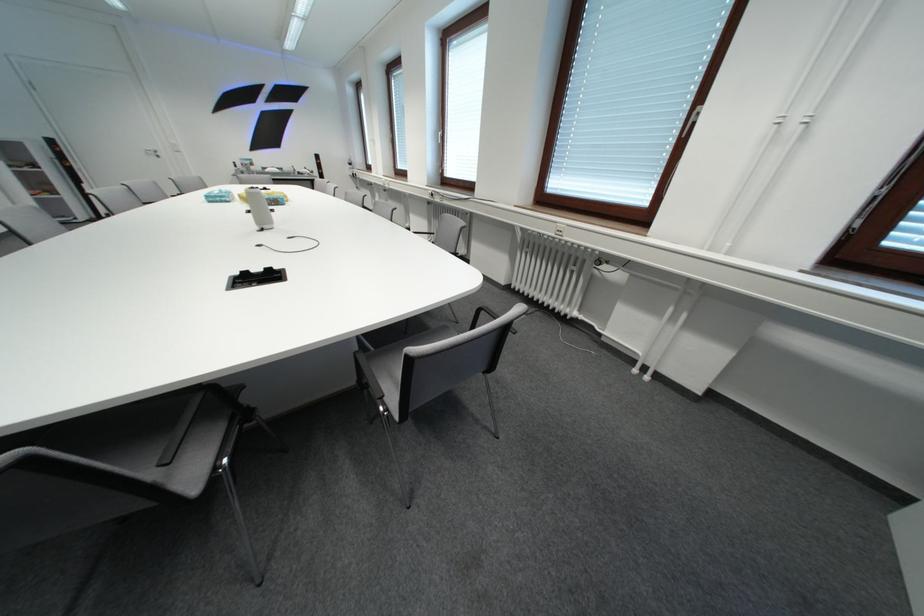
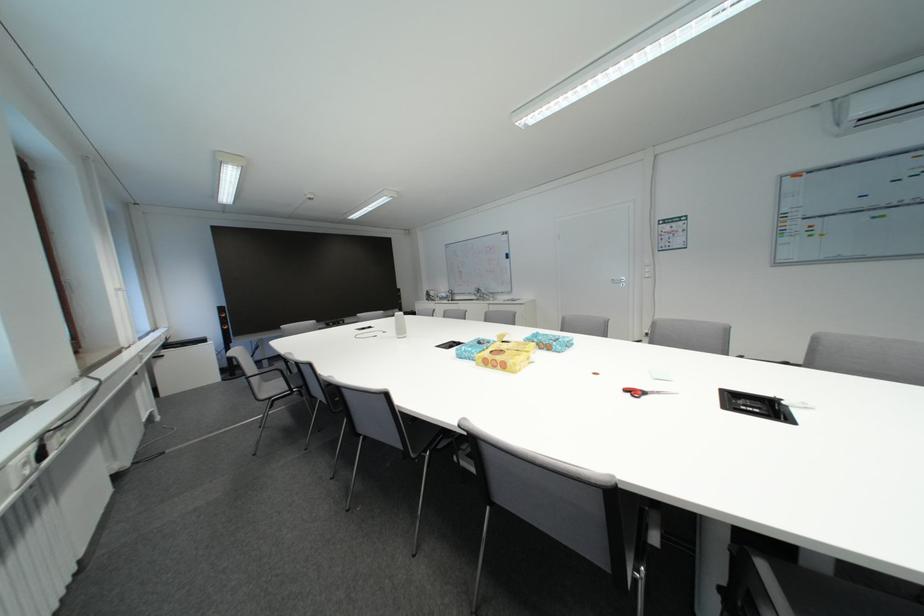
Question: I am providing you with two images of the same scene from different viewpoints. After the viewpoint changes to image2, which objects are now occluded?

Choices:
 (A) black chair armrest
 (B) white cylindrical speaker
 (C) small white paper
 (D) yellow tissue box

Answer: (A)